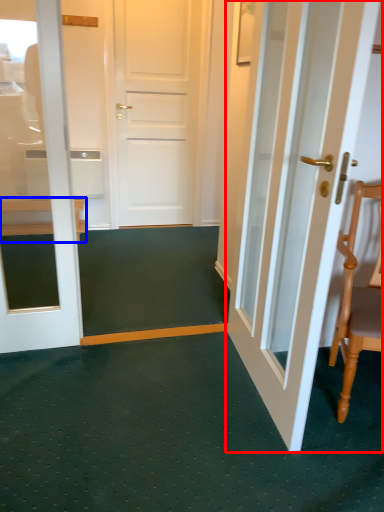
Question: Which object is further to the camera taking this photo, door (highlighted by a red box) or furniture (highlighted by a blue box)?

Choices:
 (A) door
 (B) furniture

Answer: (B)